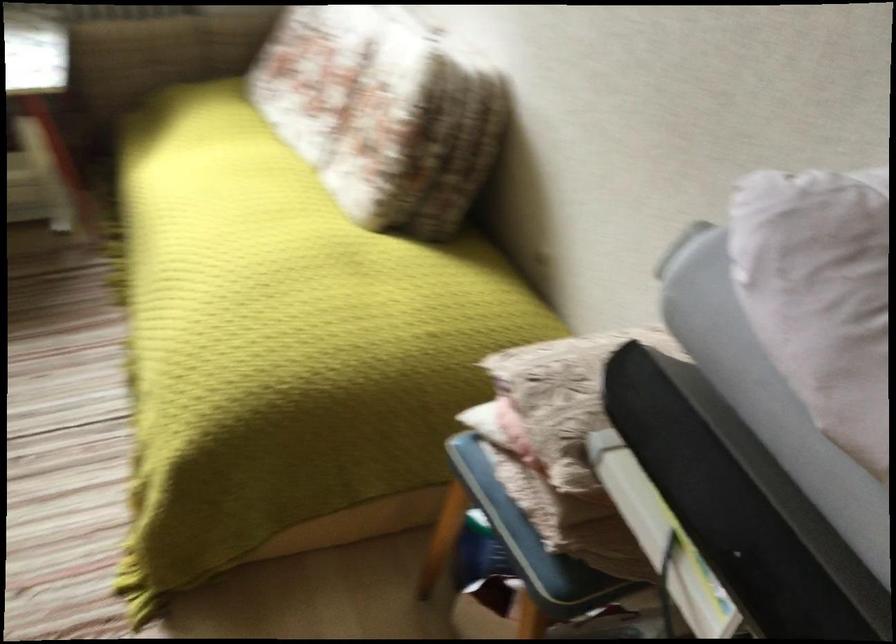
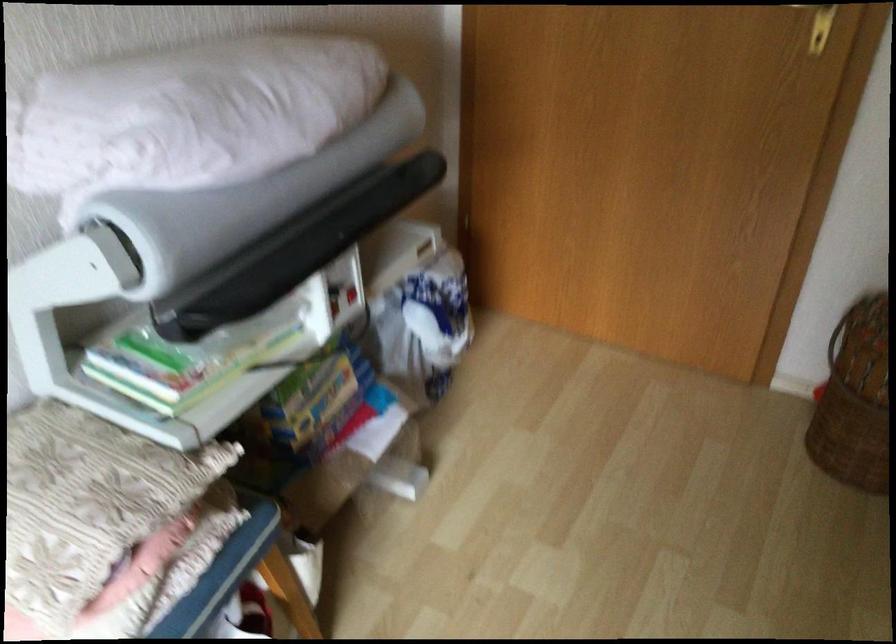
Where in the second image is the point corresponding to (x=754, y=524) from the first image?

(295, 249)